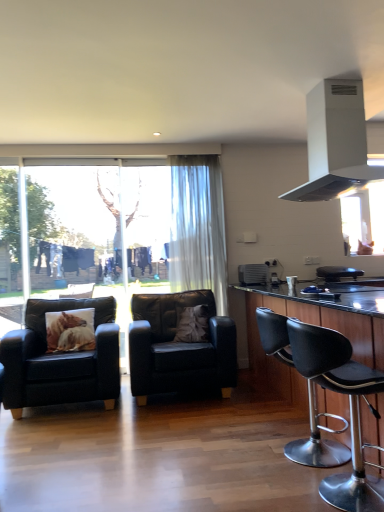
Question: From the image's perspective, does brown fabric pillow at center, arranged as the 2th pillow when viewed from the left, appear higher than black leather chair at center, which is the second chair in back-to-front order?

Choices:
 (A) no
 (B) yes

Answer: (B)

Question: Does brown fabric pillow at center, the 1th pillow from the right, lie in front of black leather chair at center, which ranks as the 3th chair in right-to-left order?

Choices:
 (A) yes
 (B) no

Answer: (B)

Question: From a real-world perspective, is brown fabric pillow at center, arranged as the 2th pillow when viewed from the left, on black leather chair at center, which ranks as the 3th chair in right-to-left order?

Choices:
 (A) yes
 (B) no

Answer: (A)

Question: Is black leather chair at center, which is the second chair in back-to-front order, completely or partially inside brown fabric pillow at center, arranged as the 2th pillow when viewed from the left?

Choices:
 (A) yes
 (B) no

Answer: (B)

Question: Considering the relative sizes of brown fabric pillow at center, arranged as the 2th pillow when viewed from the left, and black leather chair at center, which is the second chair in back-to-front order, in the image provided, is brown fabric pillow at center, arranged as the 2th pillow when viewed from the left, wider than black leather chair at center, which is the second chair in back-to-front order,?

Choices:
 (A) no
 (B) yes

Answer: (A)

Question: From the image's perspective, is brown fabric pillow at center, the 1th pillow from the right, below black leather chair at center, which is the second chair in back-to-front order?

Choices:
 (A) no
 (B) yes

Answer: (A)

Question: Could you tell me if matte black armchair at left, marked as the 1th chair in a left-to-right arrangement, is turned towards black leather chair at center, the 3th chair positioned from the front?

Choices:
 (A) no
 (B) yes

Answer: (A)

Question: Considering the relative sizes of matte black armchair at left, the 2th chair when ordered from front to back, and black leather chair at center, the 3th chair positioned from the front, in the image provided, is matte black armchair at left, the 2th chair when ordered from front to back, smaller than black leather chair at center, the 3th chair positioned from the front,?

Choices:
 (A) yes
 (B) no

Answer: (B)

Question: From a real-world perspective, is matte black armchair at left, the 4th chair from the right, under black leather chair at center, the 3th chair positioned from the front?

Choices:
 (A) no
 (B) yes

Answer: (A)

Question: Can you confirm if matte black armchair at left, the 4th chair from the right, is positioned to the right of black leather chair at center, the 2th chair positioned from the left?

Choices:
 (A) yes
 (B) no

Answer: (B)

Question: Can you confirm if matte black armchair at left, the 2th chair when ordered from front to back, is shorter than black leather chair at center, which ranks as the 3th chair in right-to-left order?

Choices:
 (A) no
 (B) yes

Answer: (A)

Question: Does matte black armchair at left, the 4th chair from the right, come in front of black leather chair at center, which is the second chair in back-to-front order?

Choices:
 (A) no
 (B) yes

Answer: (B)

Question: Does matte black armchair at left, the 2th chair when ordered from front to back, have a lesser height compared to satin silver air conditioner at center?

Choices:
 (A) no
 (B) yes

Answer: (A)